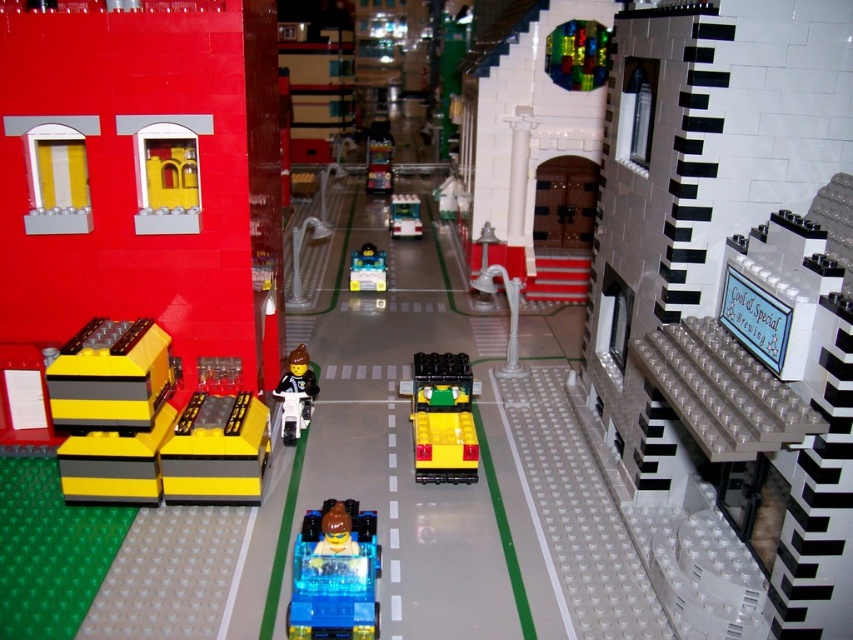
You are standing at the camera position and want to take a photo of the yellow matte car at center. Can you fit the entire car into your camera frame if your camera has a 4.5 feet minimum distance requirement?

The yellow matte car at center and camera are 5.07 feet apart, which is greater than the 4.5 feet minimum distance requirement, so yes, you can fit the entire car into your camera frame.

You are a Lego vehicle collector who wants to display both the transparent blue car at center and the translucent yellow plastic car at center on a shelf. If the shelf has a space that can only accommodate the smaller of the two cars, which car should you place there?

The translucent yellow plastic car at center should be placed on the shelf since it is smaller than the transparent blue car at center.